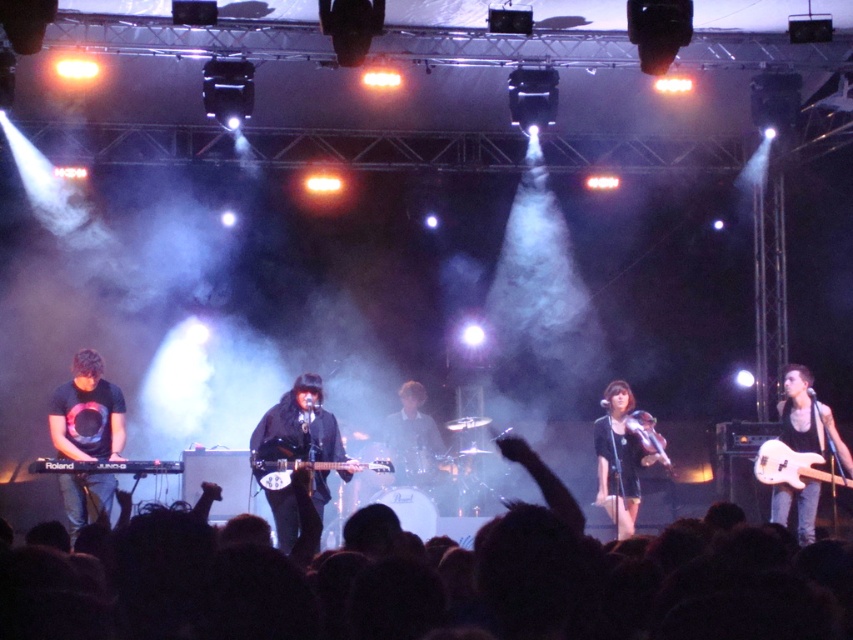
You are a photographer at the back of the stage. You want to take a photo of the black matte dress at center and the wooden violin at center. Which one will appear larger in your photo?

The black matte dress at center will appear larger in the photo because it is bigger than the wooden violin at center.

You are a photographer at the live music performance. You want to capture a photo where the black matte dress at center and the black matte keyboard at lower left are both clearly visible. Based on their positions, which object should be placed on the left side of the photo?

The black matte keyboard at lower left should be placed on the left side of the photo since the black matte dress at center is to the right of it.